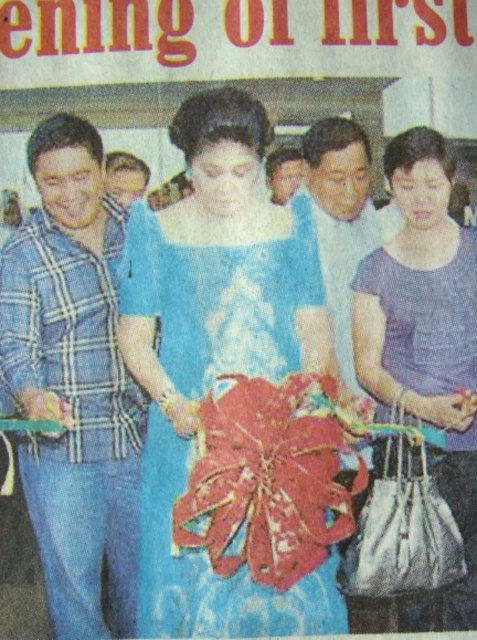
Is blue plaid shirt at left shorter than matte purple dress at right?

No.

Does point (52, 440) lie behind point (422, 259)?

That is False.

Is point (31, 456) positioned before point (447, 612)?

That is False.

You are a GUI agent. You are given a task and a screenshot of the screen. Output one action in this format:
    pyautogui.click(x=<x>, y=<y>)
    Task: Click on the blue plaid shirt at left
    The width and height of the screenshot is (477, 640).
    Given the screenshot: What is the action you would take?
    pyautogui.click(x=73, y=381)

Consider the image. Who is positioned more to the right, blue satin dress at center or matte purple dress at right?

matte purple dress at right

Who is taller, blue satin dress at center or matte purple dress at right?

blue satin dress at center

Identify the location of blue satin dress at center. Image resolution: width=477 pixels, height=640 pixels. (218, 358).

At what (x,y) coordinates should I click in order to perform the action: click on blue satin dress at center. Please return your answer as a coordinate pair (x, y). This screenshot has height=640, width=477. Looking at the image, I should click on (218, 358).

Who is positioned more to the left, blue plaid shirt at left or matte blue shirt at center?

blue plaid shirt at left

Does blue plaid shirt at left have a lesser height compared to matte blue shirt at center?

No, blue plaid shirt at left is not shorter than matte blue shirt at center.

Find the location of a particular element. This screenshot has height=640, width=477. blue plaid shirt at left is located at coordinates (73, 381).

Where is `blue plaid shirt at left`? blue plaid shirt at left is located at coordinates point(73,381).